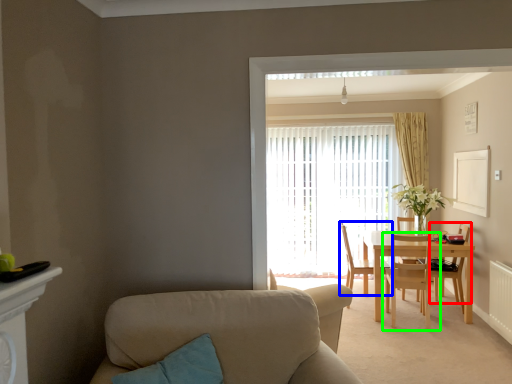
Question: Estimate the real-world distances between objects in this image. Which object is closer to chair (highlighted by a red box), chair (highlighted by a blue box) or chair (highlighted by a green box)?

Choices:
 (A) chair
 (B) chair

Answer: (B)